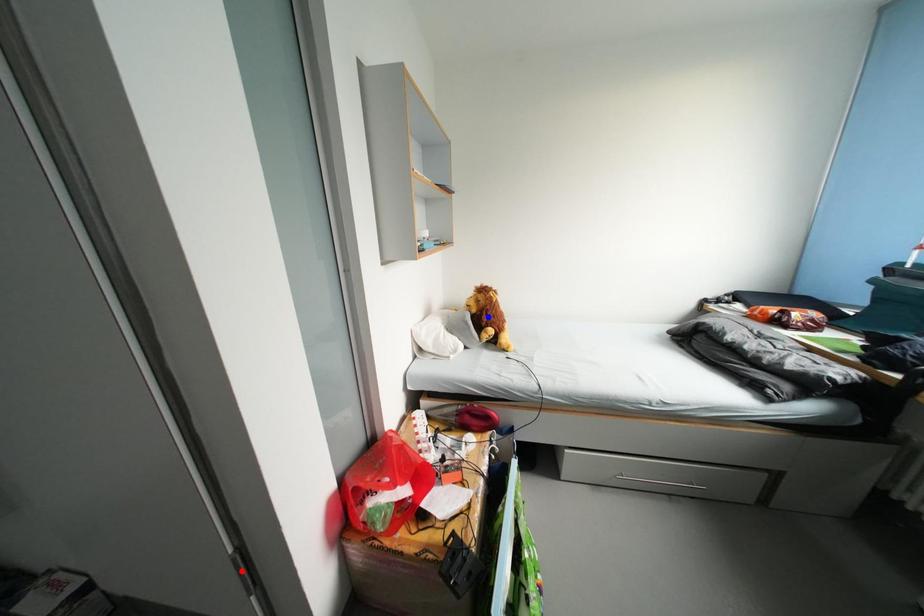
Question: In the image, two points are highlighted. Which point is nearer to the camera? Reply with the corresponding letter.

Choices:
 (A) blue point
 (B) red point

Answer: (B)